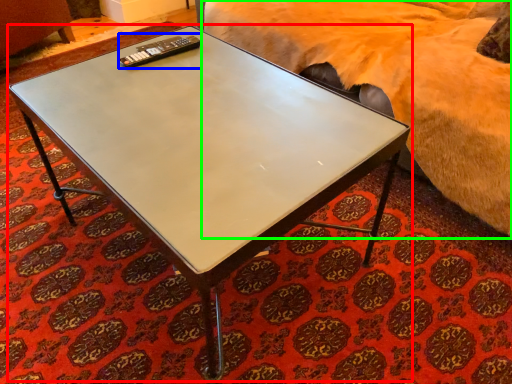
Question: Which object is positioned closest to coffee table (highlighted by a red box)? Select from remote (highlighted by a blue box) and bed (highlighted by a green box).

Choices:
 (A) remote
 (B) bed

Answer: (A)